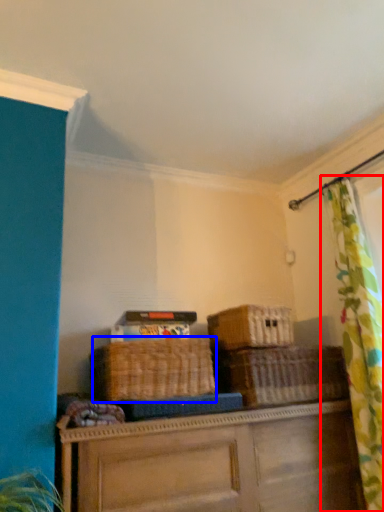
Question: Which of the following is the closest to the observer, curtain (highlighted by a red box) or basket (highlighted by a blue box)?

Choices:
 (A) curtain
 (B) basket

Answer: (A)